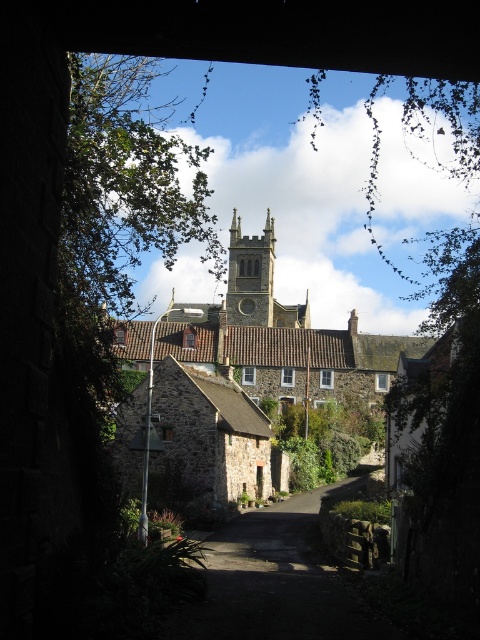
Where is `brown tiled roof church at center`? The image size is (480, 640). brown tiled roof church at center is located at coordinates (254, 364).

Image resolution: width=480 pixels, height=640 pixels. I want to click on brown tiled roof church at center, so click(x=254, y=364).

Where is `brown tiled roof church at center`? The width and height of the screenshot is (480, 640). brown tiled roof church at center is located at coordinates (254, 364).